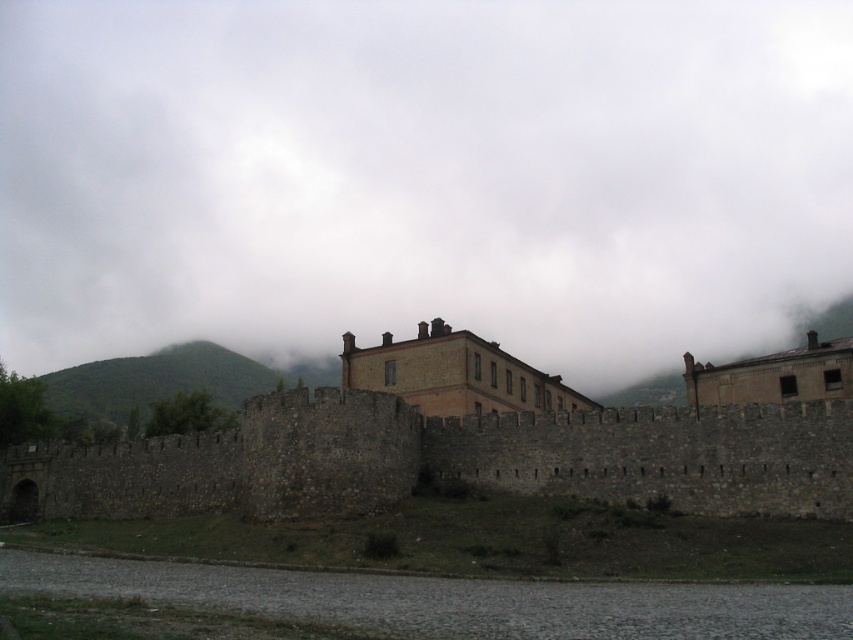
Question: Can you confirm if white fluffy cloud at upper center is bigger than stone wall at center?

Choices:
 (A) no
 (B) yes

Answer: (B)

Question: Which object is farther from the camera taking this photo?

Choices:
 (A) white fluffy cloud at upper center
 (B) stone wall at center

Answer: (A)

Question: Which point is closer to the camera?

Choices:
 (A) (666, 120)
 (B) (769, 474)

Answer: (B)

Question: In this image, where is white fluffy cloud at upper center located relative to stone wall at center?

Choices:
 (A) below
 (B) above

Answer: (B)

Question: Can you confirm if white fluffy cloud at upper center is positioned to the right of stone wall at center?

Choices:
 (A) no
 (B) yes

Answer: (A)

Question: Among these objects, which one is nearest to the camera?

Choices:
 (A) stone wall at center
 (B) white fluffy cloud at upper center

Answer: (A)